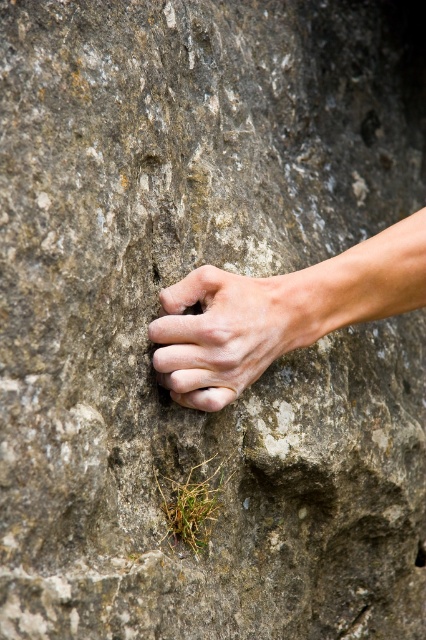
Question: Does smooth skin hand at center come in front of white matte hand at center?

Choices:
 (A) yes
 (B) no

Answer: (B)

Question: Which point appears farthest from the camera in this image?

Choices:
 (A) (388, 308)
 (B) (169, 330)

Answer: (A)

Question: Can you confirm if smooth skin hand at center is smaller than white matte hand at center?

Choices:
 (A) no
 (B) yes

Answer: (A)

Question: Can you confirm if smooth skin hand at center is positioned to the right of white matte hand at center?

Choices:
 (A) yes
 (B) no

Answer: (A)

Question: Which point is closer to the camera?

Choices:
 (A) (216, 276)
 (B) (189, 333)

Answer: (B)